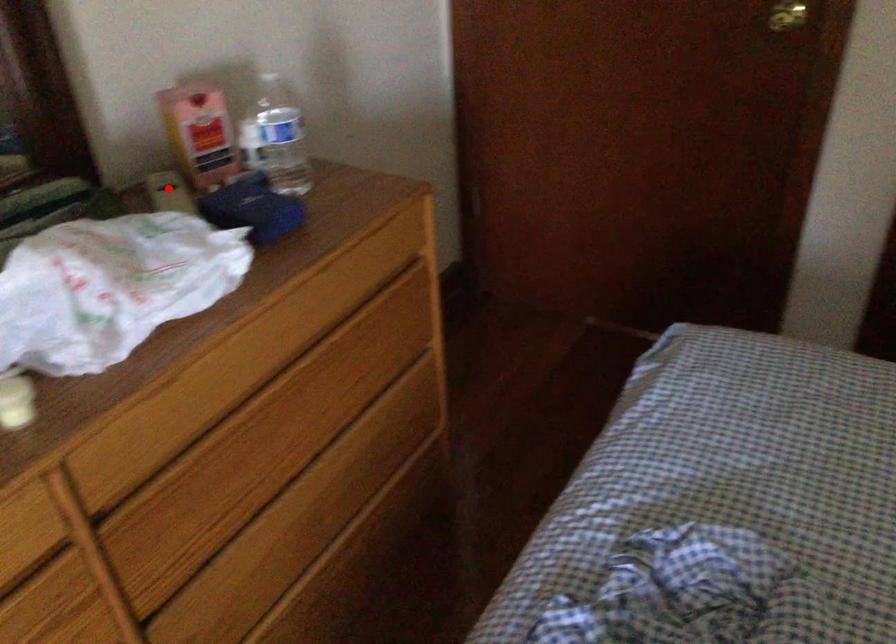
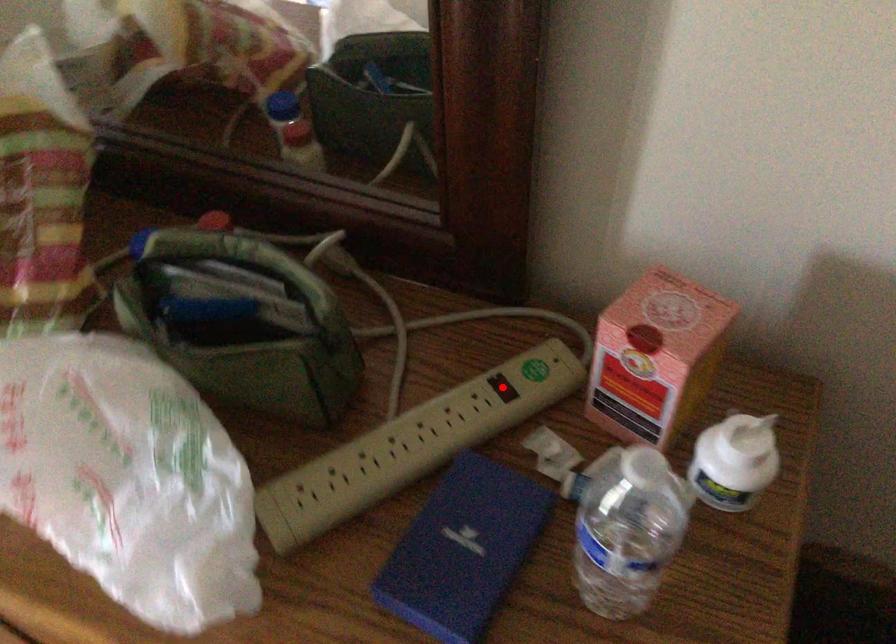
I am providing you with two images of the same scene from different viewpoints. A red point is marked on the first image and another point is marked on the second image. Do the highlighted points in image1 and image2 indicate the same real-world spot?

Yes